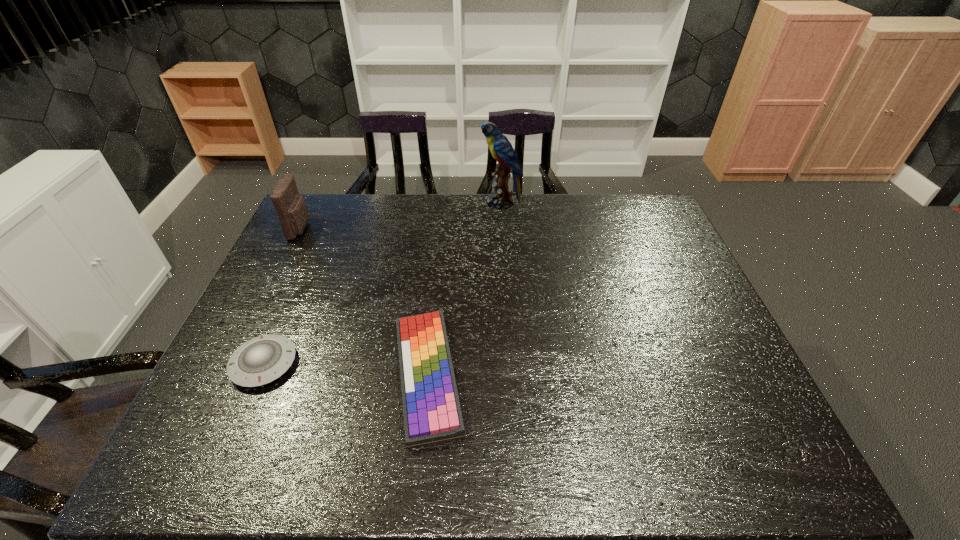
The width and height of the screenshot is (960, 540). I want to click on vacant space located 0.260m on the back of the saucer, so click(304, 271).

Locate an element on the screen. The width and height of the screenshot is (960, 540). free space located 0.050m on the front of the second object from right to left is located at coordinates (418, 472).

You are a GUI agent. You are given a task and a screenshot of the screen. Output one action in this format:
    pyautogui.click(x=<x>, y=<y>)
    Task: Click on the parrot that is at the far edge
    The image size is (960, 540).
    Given the screenshot: What is the action you would take?
    pyautogui.click(x=501, y=149)

The width and height of the screenshot is (960, 540). I want to click on pouch that is positioned at the far edge, so click(290, 207).

Identify the location of object at the near edge. Image resolution: width=960 pixels, height=540 pixels. (432, 414).

At what (x,y) coordinates should I click in order to perform the action: click on pouch that is positioned at the left edge. Please return your answer as a coordinate pair (x, y). Looking at the image, I should click on (290, 207).

Locate an element on the screen. Image resolution: width=960 pixels, height=540 pixels. saucer present at the left edge is located at coordinates (261, 360).

Find the location of a particular element. The width and height of the screenshot is (960, 540). object that is at the far left corner is located at coordinates [x=290, y=207].

Find the location of `free space at the far edge`. free space at the far edge is located at coordinates (403, 206).

This screenshot has width=960, height=540. What are the coordinates of `vacant space at the near edge of the desktop` in the screenshot? It's located at (566, 450).